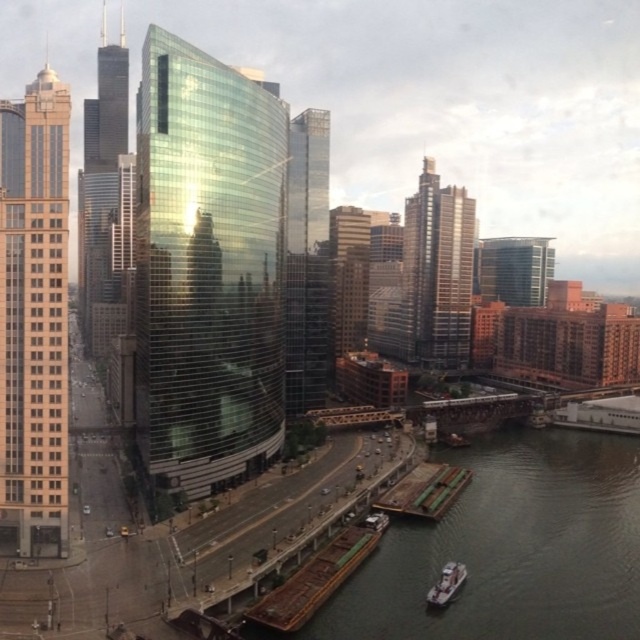
Question: Can you confirm if shiny glass skyscraper at center is thinner than brown wooden dock at lower right?

Choices:
 (A) yes
 (B) no

Answer: (B)

Question: Estimate the real-world distances between objects in this image. Which object is closer to the green metallic river at lower center?

Choices:
 (A) brown wooden dock at lower center
 (B) transparent glass skyscraper at center
 (C) glassy reflective skyscraper at center
 (D) matte gold skyscraper at left

Answer: (A)

Question: Which of the following is the closest to the observer?

Choices:
 (A) brown wooden dock at lower center
 (B) brown wooden dock at lower right
 (C) glassy reflective skyscraper at center

Answer: (A)

Question: Is glassy reflective skyscraper at center closer to camera compared to brown wooden dock at lower right?

Choices:
 (A) no
 (B) yes

Answer: (A)

Question: Does green metallic river at lower center appear on the right side of white plastic boat at lower right?

Choices:
 (A) no
 (B) yes

Answer: (B)

Question: Which point appears closest to the camera in this image?

Choices:
 (A) (294, 250)
 (B) (444, 508)

Answer: (B)